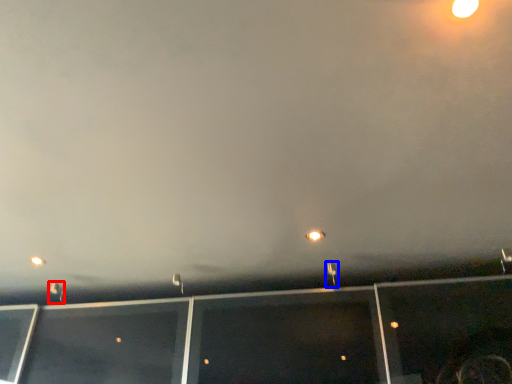
Question: Which of the following is the farthest to the observer, street light (highlighted by a red box) or street light (highlighted by a blue box)?

Choices:
 (A) street light
 (B) street light

Answer: (A)